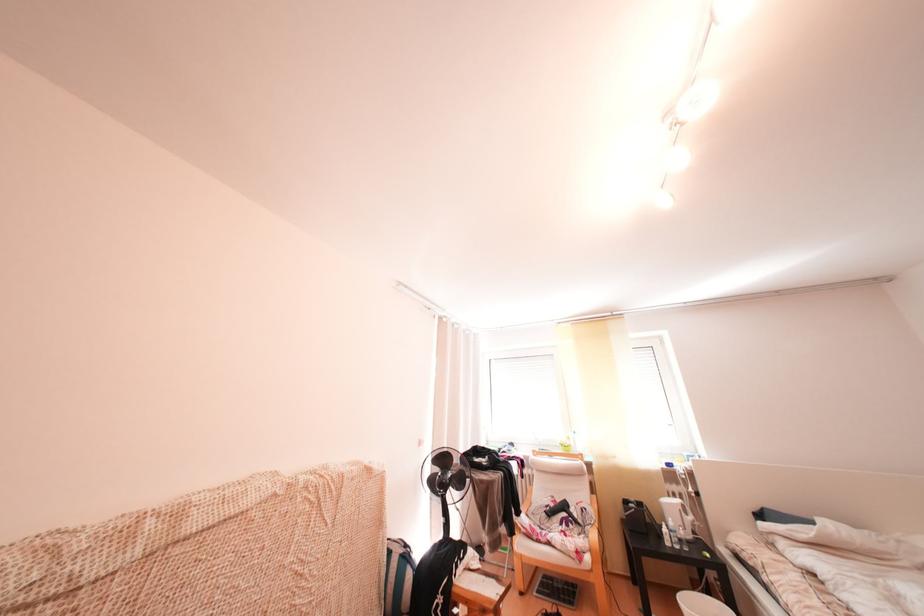
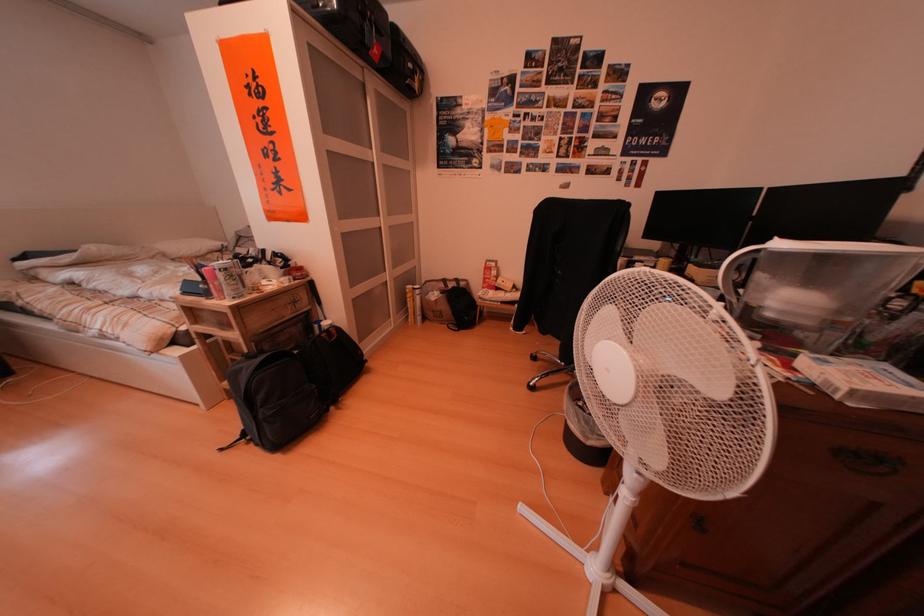
In the scene shown: How did the camera likely rotate?

The camera rotated toward right-down.